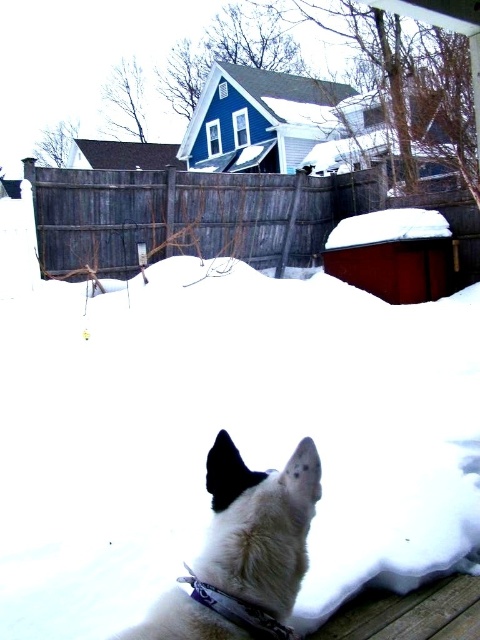
You are standing at the center of the snow yard and want to find the white matte dog at lower center. According to the coordinates given, in which direction should you move to locate it?

The white matte dog at lower center is located at coordinates point (242, 552). Since you are at the center, you should move towards the right direction to locate it.

You are standing at the edge of the yard and want to place a small snowman exactly where the white fluffy snow at center is. Can you confirm the exact coordinates to ensure the snowman is built in the right spot?

The white fluffy snow at center is located at point (229, 433), so you should place the snowman at those coordinates to ensure it is built in the correct location.